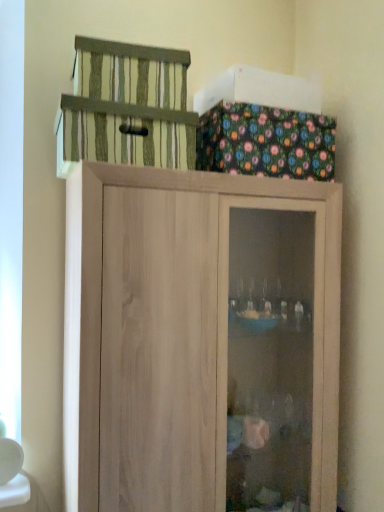
Locate an element on the screen. striped fabric cage at upper center is located at coordinates click(x=126, y=106).

From the picture: In order to face striped fabric cage at upper center, should I rotate leftwards or rightwards?

Rotate your view left by about 8.846°.

What do you see at coordinates (126, 106) in the screenshot? This screenshot has height=512, width=384. I see `striped fabric cage at upper center` at bounding box center [126, 106].

Image resolution: width=384 pixels, height=512 pixels. What do you see at coordinates (200, 341) in the screenshot?
I see `natural wood cupboard at upper center` at bounding box center [200, 341].

Measure the distance between natural wood cupboard at upper center and camera.

The depth of natural wood cupboard at upper center is 1.17 meters.

The image size is (384, 512). What are the coordinates of `natural wood cupboard at upper center` in the screenshot? It's located at (200, 341).

Locate an element on the screen. The height and width of the screenshot is (512, 384). striped fabric cage at upper center is located at coordinates (126, 106).

Between natural wood cupboard at upper center and striped fabric cage at upper center, which one appears on the right side from the viewer's perspective?

From the viewer's perspective, natural wood cupboard at upper center appears more on the right side.

Which is behind, natural wood cupboard at upper center or striped fabric cage at upper center?

striped fabric cage at upper center is further from the camera.

Between point (99, 174) and point (79, 75), which one is positioned in front?

The point (99, 174) is closer to the camera.

From the image's perspective, is natural wood cupboard at upper center positioned above or below striped fabric cage at upper center?

Clearly, from the image's perspective, natural wood cupboard at upper center is below striped fabric cage at upper center.

From a real-world perspective, does natural wood cupboard at upper center sit lower than striped fabric cage at upper center?

Correct, in the physical world, natural wood cupboard at upper center is lower than striped fabric cage at upper center.

Which of these two, natural wood cupboard at upper center or striped fabric cage at upper center, is wider?

natural wood cupboard at upper center is wider.

In the scene shown: Can you confirm if natural wood cupboard at upper center is taller than striped fabric cage at upper center?

Yes, natural wood cupboard at upper center is taller than striped fabric cage at upper center.

Which of these two, natural wood cupboard at upper center or striped fabric cage at upper center, is bigger?

Bigger between the two is natural wood cupboard at upper center.

Is natural wood cupboard at upper center not inside striped fabric cage at upper center?

natural wood cupboard at upper center is positioned outside striped fabric cage at upper center.

Would you consider natural wood cupboard at upper center to be distant from striped fabric cage at upper center?

Actually, natural wood cupboard at upper center and striped fabric cage at upper center are a little close together.

Is natural wood cupboard at upper center aimed at striped fabric cage at upper center?

No, natural wood cupboard at upper center is not turned towards striped fabric cage at upper center.

What's the angular difference between natural wood cupboard at upper center and striped fabric cage at upper center's facing directions?

There is a 4.73-degree angle between the facing directions of natural wood cupboard at upper center and striped fabric cage at upper center.

The image size is (384, 512). Identify the location of cage above the natural wood cupboard at upper center (from a real-world perspective). (126, 106).

Which is more to the right, striped fabric cage at upper center or natural wood cupboard at upper center?

natural wood cupboard at upper center is more to the right.

Is striped fabric cage at upper center positioned before natural wood cupboard at upper center?

No, it is not.

Is point (120, 92) farther from viewer compared to point (318, 368)?

No, (120, 92) is in front of (318, 368).

From the image's perspective, would you say striped fabric cage at upper center is shown under natural wood cupboard at upper center?

No.

From a real-world perspective, between striped fabric cage at upper center and natural wood cupboard at upper center, who is vertically higher?

striped fabric cage at upper center.

In terms of width, does striped fabric cage at upper center look wider or thinner when compared to natural wood cupboard at upper center?

In the image, striped fabric cage at upper center appears to be more narrow than natural wood cupboard at upper center.

Who is shorter, striped fabric cage at upper center or natural wood cupboard at upper center?

striped fabric cage at upper center.

Based on their sizes in the image, would you say striped fabric cage at upper center is bigger or smaller than natural wood cupboard at upper center?

In the image, striped fabric cage at upper center appears to be smaller than natural wood cupboard at upper center.

Is striped fabric cage at upper center not inside natural wood cupboard at upper center?

Result: striped fabric cage at upper center is positioned outside natural wood cupboard at upper center.

Is striped fabric cage at upper center far from natural wood cupboard at upper center?

No, striped fabric cage at upper center is not far from natural wood cupboard at upper center.

Is striped fabric cage at upper center looking in the opposite direction of natural wood cupboard at upper center?

That's not correct — striped fabric cage at upper center is not looking away from natural wood cupboard at upper center.

What's the angular difference between striped fabric cage at upper center and natural wood cupboard at upper center's facing directions?

There is a 4.73-degree angle between the facing directions of striped fabric cage at upper center and natural wood cupboard at upper center.

How much distance is there between striped fabric cage at upper center and natural wood cupboard at upper center?

striped fabric cage at upper center is 18.57 inches away from natural wood cupboard at upper center.

Locate an element on the screen. This screenshot has width=384, height=512. cupboard that is on the right side of striped fabric cage at upper center is located at coordinates (200, 341).

Identify the location of cupboard in front of the striped fabric cage at upper center. The width and height of the screenshot is (384, 512). (200, 341).

This screenshot has width=384, height=512. What are the coordinates of `cage above the natural wood cupboard at upper center (from a real-world perspective)` in the screenshot? It's located at (126, 106).